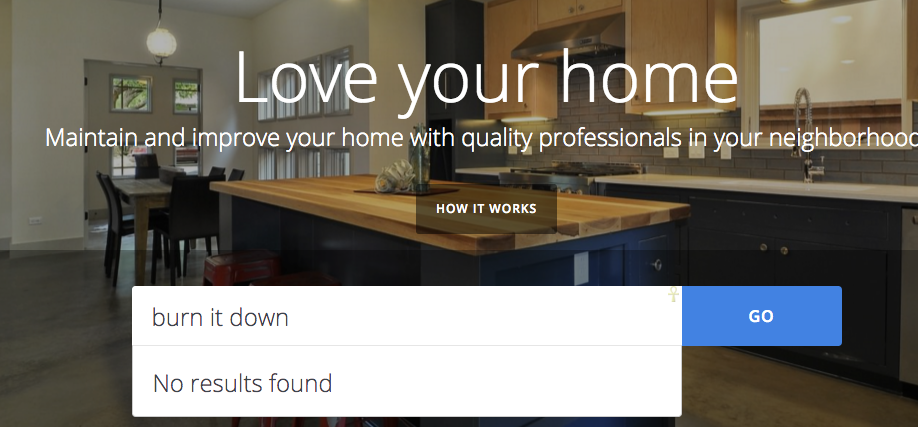
At what (x,y) coordinates should I click in order to perform the action: click on kitchen table. Please return your answer as a coordinate pair (x, y). The height and width of the screenshot is (427, 918). Looking at the image, I should click on (173, 196).